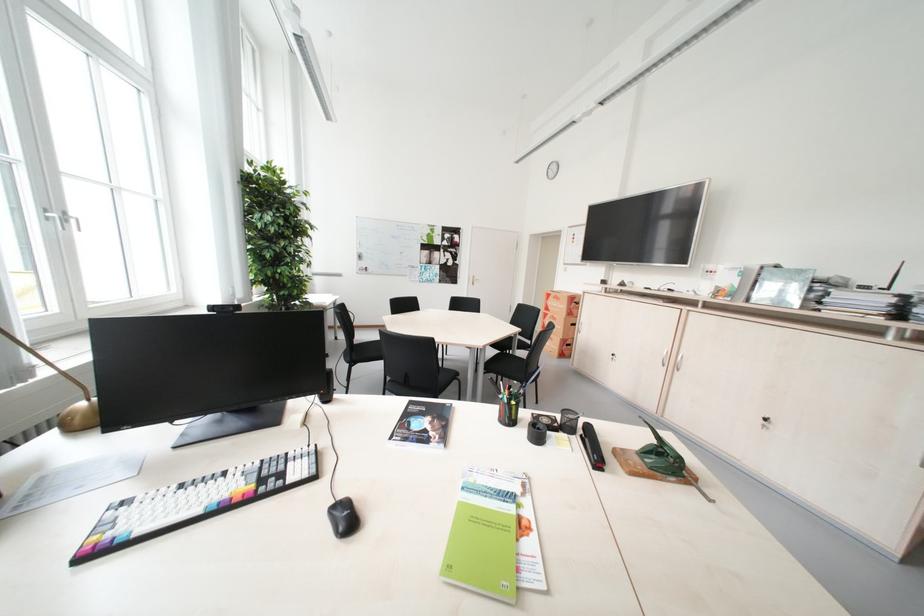
Describe the element at coordinates (343, 517) in the screenshot. I see `a black computer mouse` at that location.